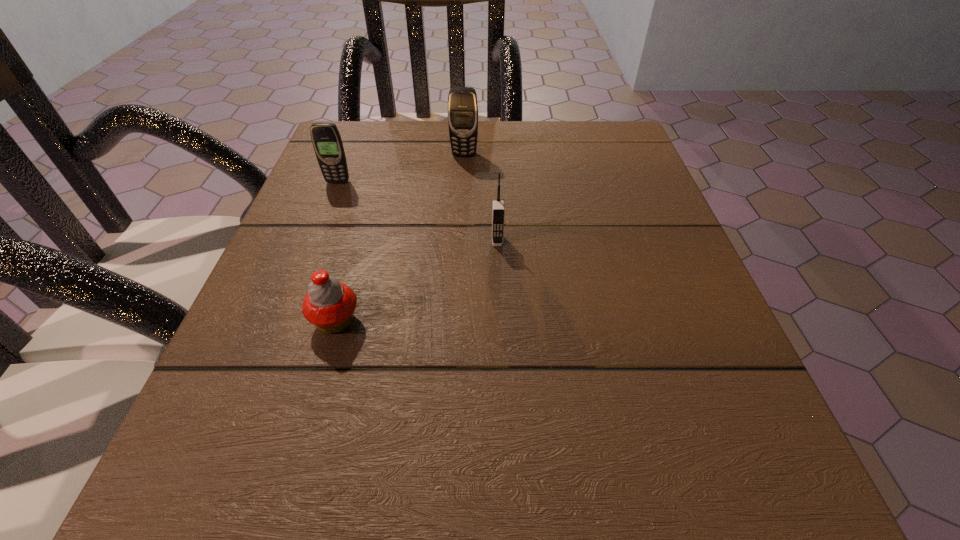
Locate which object ranks second in proximity to the nearest object. Please provide its 2D coordinates. Your answer should be formatted as a tuple, i.e. [(x, y)], where the tuple contains the x and y coordinates of a point satisfying the conditions above.

[(326, 139)]

Identify which object is the closest to the farthest cellular telephone. Please provide its 2D coordinates. Your answer should be formatted as a tuple, i.e. [(x, y)], where the tuple contains the x and y coordinates of a point satisfying the conditions above.

[(326, 139)]

At what (x,y) coordinates should I click in order to perform the action: click on cellular telephone that is the second nearest to the second object from left to right. Please return your answer as a coordinate pair (x, y). Image resolution: width=960 pixels, height=540 pixels. Looking at the image, I should click on (326, 139).

Locate an element on the screen. This screenshot has width=960, height=540. cellular telephone that is the nearest to the leftmost cellular telephone is located at coordinates (462, 101).

The width and height of the screenshot is (960, 540). Find the location of `vacant position in the image that satisfies the following two spatial constraints: 1. on the screen of the shortest object; 2. on the left side of the second farthest cellular telephone`. vacant position in the image that satisfies the following two spatial constraints: 1. on the screen of the shortest object; 2. on the left side of the second farthest cellular telephone is located at coordinates (283, 321).

The width and height of the screenshot is (960, 540). In order to click on vacant space that satisfies the following two spatial constraints: 1. on the screen of the nearest object; 2. on the right side of the leftmost object in this screenshot , I will do `click(283, 321)`.